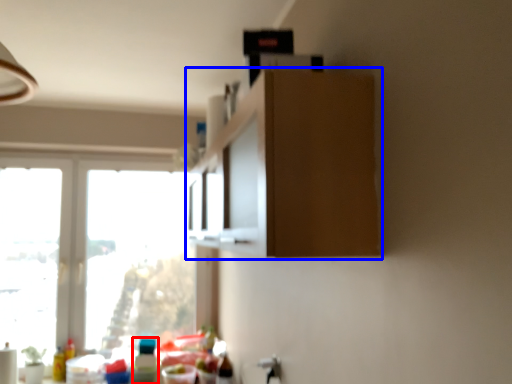
Question: Which object is further to the camera taking this photo, bottle (highlighted by a red box) or cabinetry (highlighted by a blue box)?

Choices:
 (A) bottle
 (B) cabinetry

Answer: (A)